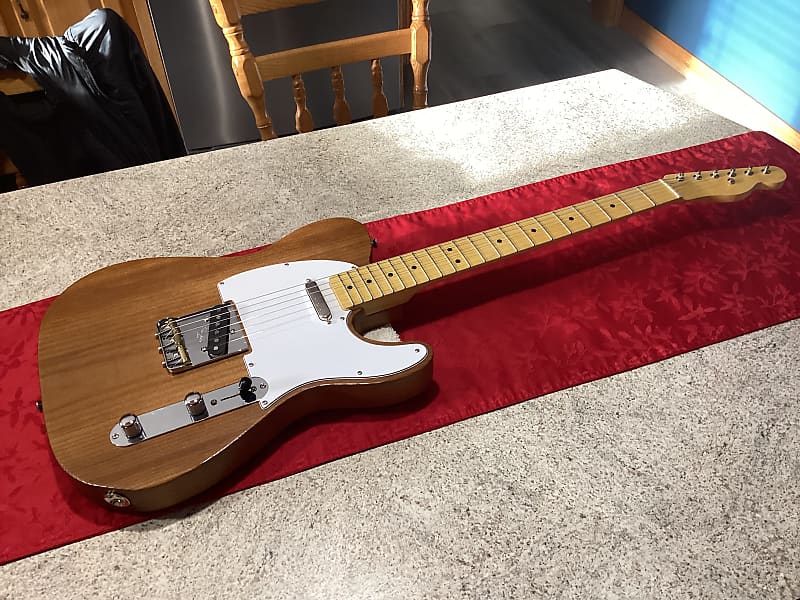
At what (x,y) coordinates should I click in order to perform the action: click on velvet. Please return your answer as a coordinate pair (x, y). The height and width of the screenshot is (600, 800). Looking at the image, I should click on (510, 325).